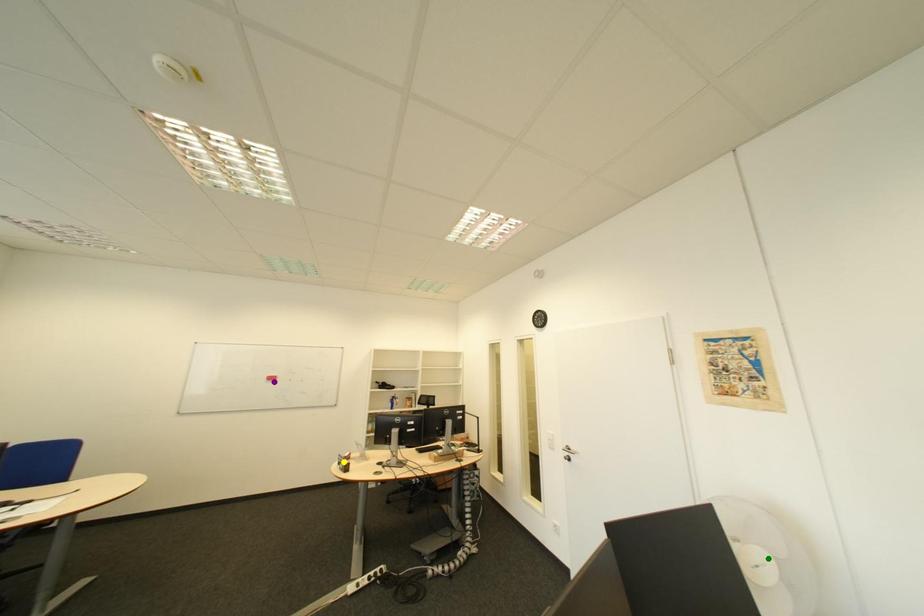
Order these from farthest to nearest:
1. green point
2. purple point
3. yellow point

purple point, yellow point, green point